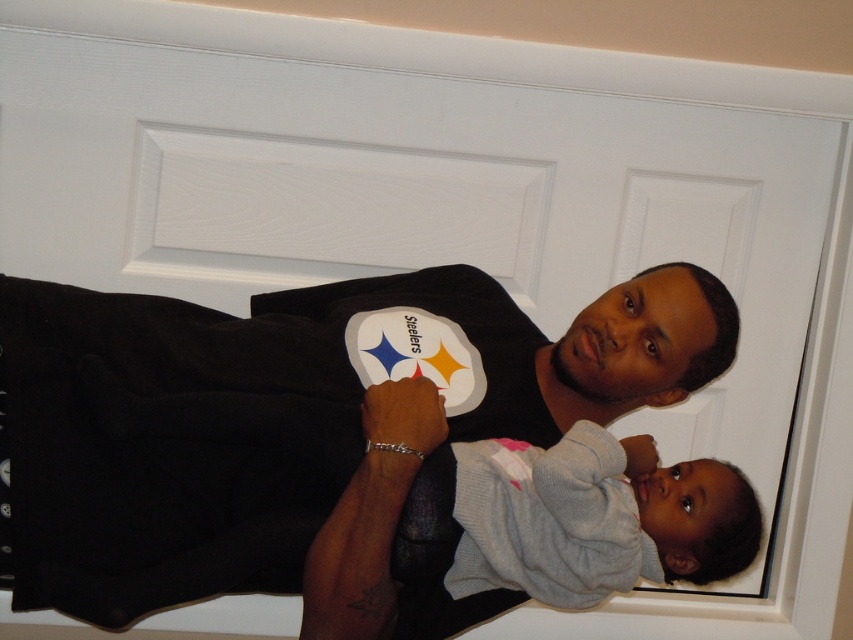
You are a photographer setting up for a family photo. You need to decide which clothing item to focus on first based on their sizes. Which item should you focus on first between the black cotton shirt at center and the gray sweater at center?

The black cotton shirt at center has a larger size compared to the gray sweater at center, so you should focus on the black cotton shirt at center first because it is bigger and might require more attention in the composition.

You are a photographer setting up for a family photo. You see a black cotton shirt at center and a gray sweater at center. Which clothing item is more to the left?

The black cotton shirt at center is more to the left than the gray sweater at center.